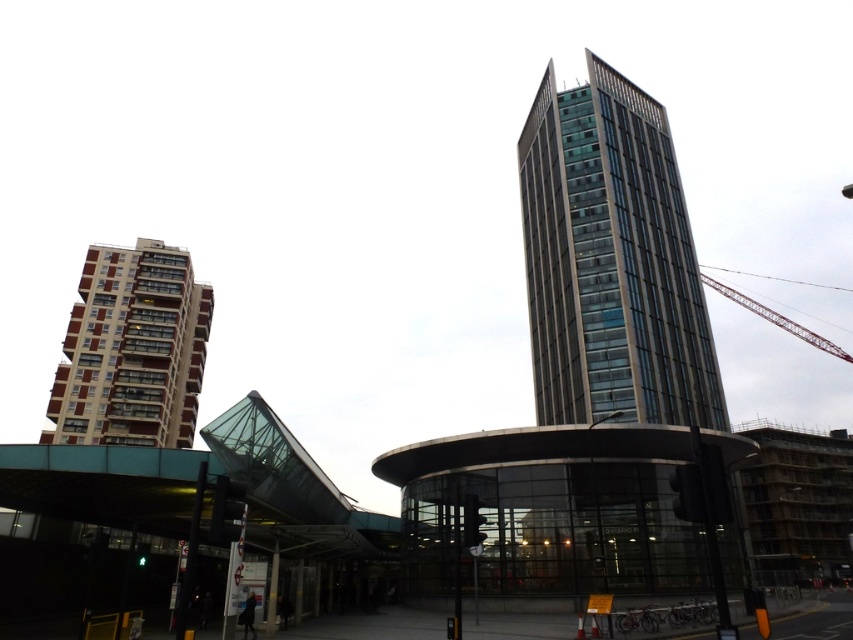
You are an architect analyzing the urban layout. Based on the scene, which object is shorter between the beige concrete building at lower left and the metallic red crane at upper right?

The beige concrete building at lower left is shorter than the metallic red crane at upper right.

You are standing at point (x=611, y=260) in the urban scene. Looking around, you see a glassy steel tower at upper right. What is the nearest object to your current position?

The nearest object to your current position at point (x=611, y=260) is the glassy steel tower at upper right as it is located directly at that coordinate.

You are standing in the urban scene and want to take a photo of the glassy steel tower at upper right. Given that your camera has a field of view that can capture objects within a 100m radius from your current position, and you are currently at coordinates point A, which is located at point A coordinates at point A coordinates at point A coordinates at point A coordinates at point A coordinates at point A coordinates at point A coordinates at point A coordinates at point A coordinates at point A coordinates

The glassy steel tower at upper right is located at point A coordinates at point A coordinates at point A coordinates at point A coordinates at point A coordinates at point A coordinates at point A coordinates at point A coordinates at point A coordinates at point A coordinates at point A coordinates